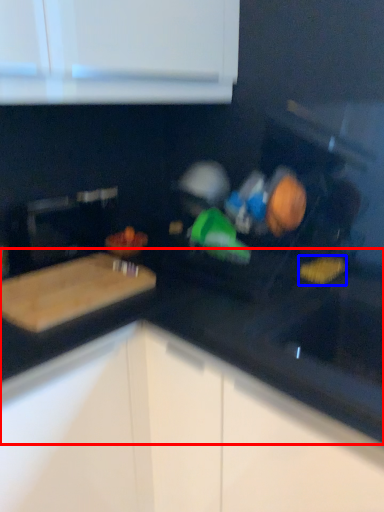
Question: Among these objects, which one is nearest to the camera, countertop (highlighted by a red box) or food (highlighted by a blue box)?

Choices:
 (A) countertop
 (B) food

Answer: (A)